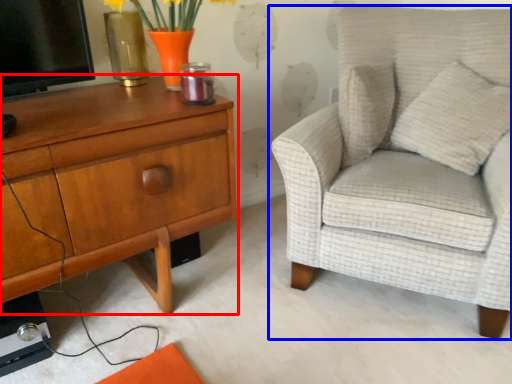
Question: Which object is further to the camera taking this photo, nightstand (highlighted by a red box) or chair (highlighted by a blue box)?

Choices:
 (A) nightstand
 (B) chair

Answer: (B)